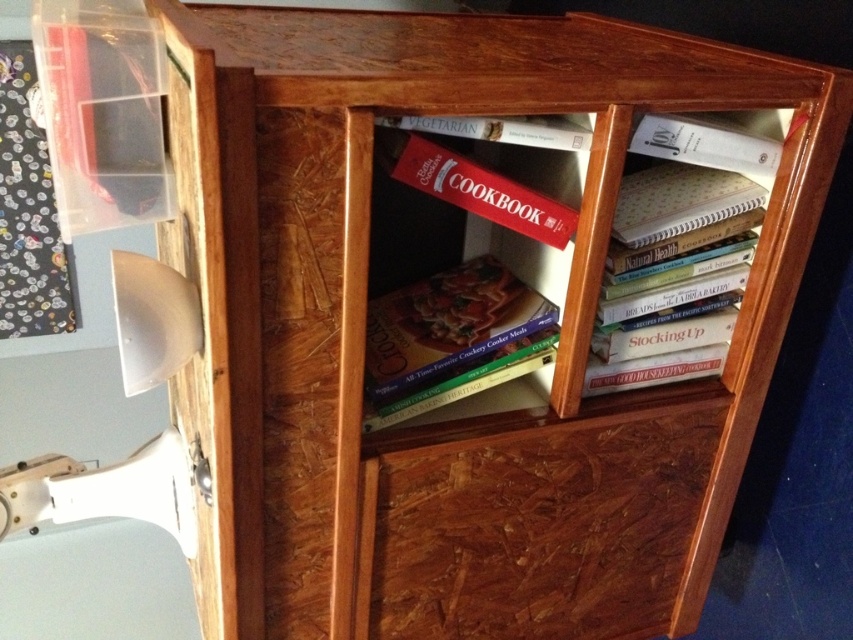
You are standing in front of the wooden cabinet and want to place a small object between the two points labeled point (728, 120) and point (486, 140). Which point should you place it closer to in order to have it closer to you?

You should place the object closer to point (728, 120) because it is closer to you than point (486, 140).

You are organizing a document on the wooden cabinet with OSB surface. There is a white paper at upper right. Where exactly is the white paper located in terms of coordinates?

The white paper at upper right is located at coordinates point (712,141).